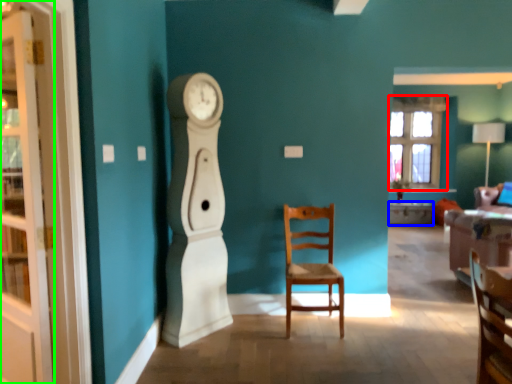
Question: Which object is positioned farthest from window (highlighted by a red box)? Select from desk (highlighted by a blue box) and cabinetry (highlighted by a green box).

Choices:
 (A) desk
 (B) cabinetry

Answer: (B)